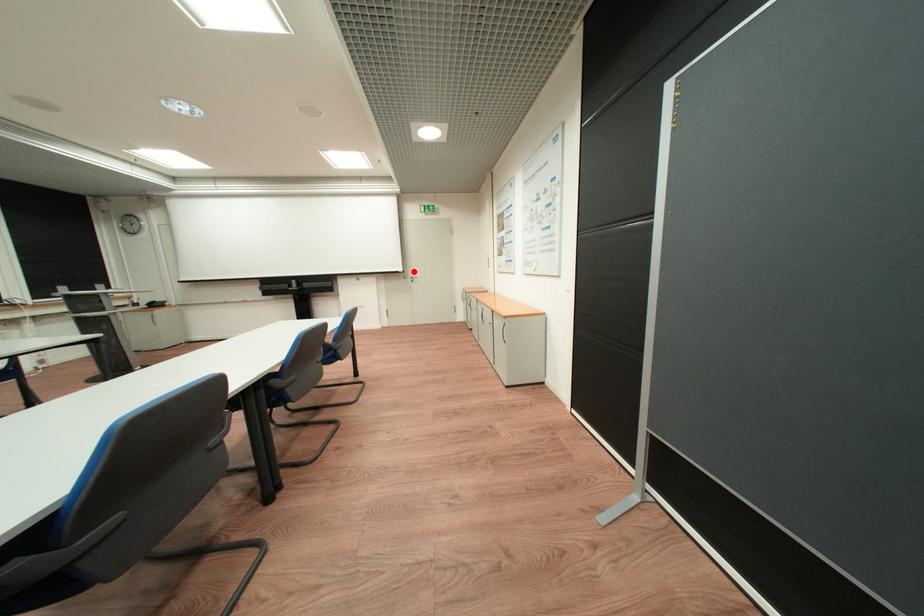
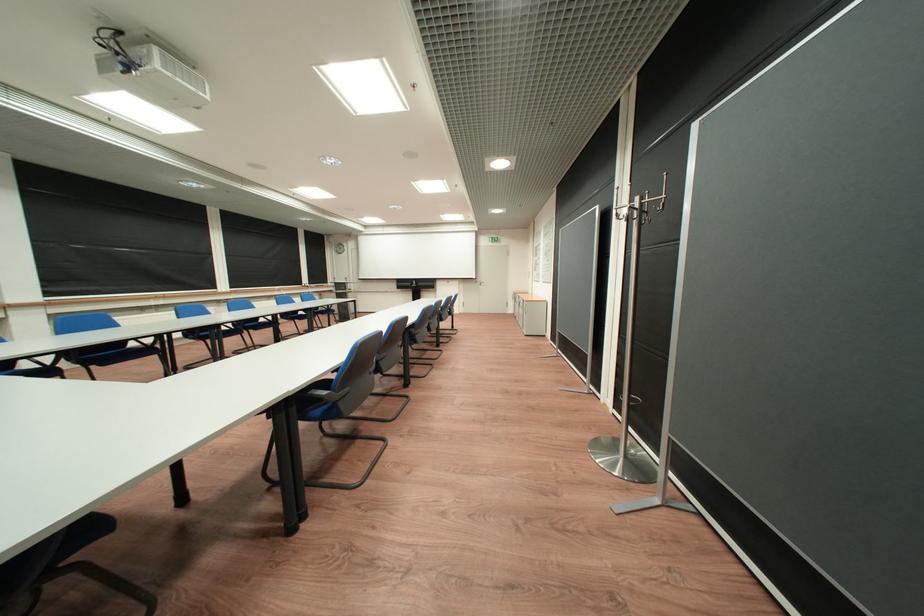
In the second image, find the point that corresponds to the highlighted location in the first image.

(487, 278)